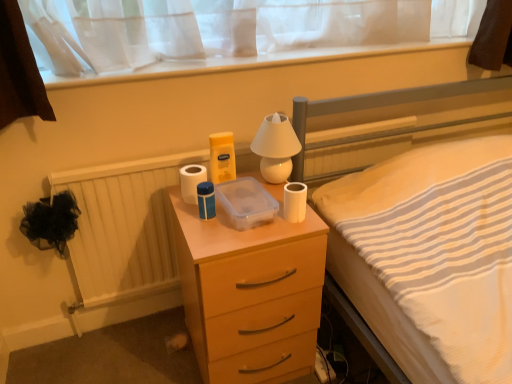
Question: From a real-world perspective, is white matte toilet paper at right, arranged as the first toilet paper when viewed from the front, physically above white matte toilet paper at center, positioned as the first toilet paper in left-to-right order?

Choices:
 (A) yes
 (B) no

Answer: (B)

Question: From the image's perspective, is white matte toilet paper at right, which is the second toilet paper in back-to-front order, beneath white matte toilet paper at center, the 2th toilet paper positioned from the front?

Choices:
 (A) no
 (B) yes

Answer: (B)

Question: Considering the relative sizes of white matte toilet paper at right, which is the second toilet paper in back-to-front order, and white matte toilet paper at center, the 2th toilet paper positioned from the front, in the image provided, is white matte toilet paper at right, which is the second toilet paper in back-to-front order, smaller than white matte toilet paper at center, the 2th toilet paper positioned from the front,?

Choices:
 (A) no
 (B) yes

Answer: (B)

Question: Considering the relative positions of white matte toilet paper at right, which is the second toilet paper in back-to-front order, and white matte toilet paper at center, the second toilet paper from the right, in the image provided, is white matte toilet paper at right, which is the second toilet paper in back-to-front order, to the left of white matte toilet paper at center, the second toilet paper from the right, from the viewer's perspective?

Choices:
 (A) yes
 (B) no

Answer: (B)

Question: Is white matte toilet paper at center, the 2th toilet paper positioned from the front, located within white matte toilet paper at right, which is the second toilet paper in back-to-front order?

Choices:
 (A) yes
 (B) no

Answer: (B)

Question: In the image, is white matte toilet paper at right, which appears as the 2th toilet paper when viewed from the left, on the left side or the right side of matte wood chest of drawers at center?

Choices:
 (A) left
 (B) right

Answer: (B)

Question: Considering their positions, is white matte toilet paper at right, which appears as the 2th toilet paper when viewed from the left, located in front of or behind matte wood chest of drawers at center?

Choices:
 (A) front
 (B) behind

Answer: (B)

Question: Does point (296, 213) appear closer or farther from the camera than point (200, 339)?

Choices:
 (A) closer
 (B) farther

Answer: (A)

Question: Considering the positions of white matte toilet paper at right, which is the second toilet paper in back-to-front order, and matte wood chest of drawers at center in the image, is white matte toilet paper at right, which is the second toilet paper in back-to-front order, taller or shorter than matte wood chest of drawers at center?

Choices:
 (A) short
 (B) tall

Answer: (A)

Question: In terms of height, does white matte toilet paper at right, which is counted as the first toilet paper, starting from the right, look taller or shorter compared to white matte toilet paper at center, the second toilet paper from the right?

Choices:
 (A) short
 (B) tall

Answer: (A)

Question: In terms of width, does white matte toilet paper at right, which is counted as the first toilet paper, starting from the right, look wider or thinner when compared to white matte toilet paper at center, the 2th toilet paper positioned from the front?

Choices:
 (A) thin
 (B) wide

Answer: (A)

Question: From the image's perspective, relative to white matte toilet paper at center, the 2th toilet paper positioned from the front, is white matte toilet paper at right, which is counted as the first toilet paper, starting from the right, above or below?

Choices:
 (A) below
 (B) above

Answer: (A)

Question: From a real-world perspective, is white matte toilet paper at right, which appears as the 2th toilet paper when viewed from the left, physically located above or below white matte toilet paper at center, the second toilet paper from the right?

Choices:
 (A) below
 (B) above

Answer: (A)

Question: From a real-world perspective, relative to matte wood chest of drawers at center, is white glossy lamp at upper center vertically above or below?

Choices:
 (A) above
 (B) below

Answer: (A)

Question: Considering their positions, is white glossy lamp at upper center located in front of or behind matte wood chest of drawers at center?

Choices:
 (A) front
 (B) behind

Answer: (B)